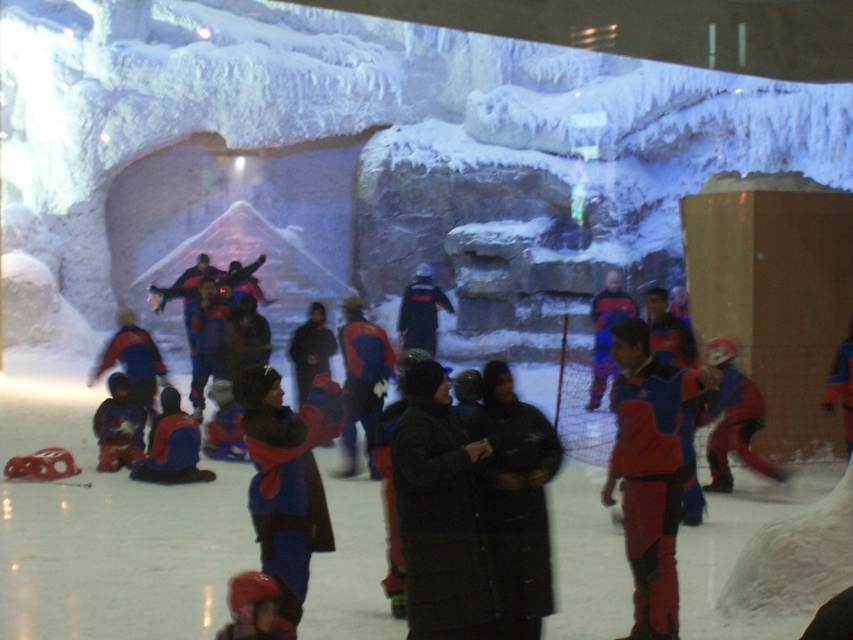
Does matte blue ski suit at center have a lesser height compared to blue fabric snowsuit at center?

In fact, matte blue ski suit at center may be taller than blue fabric snowsuit at center.

This screenshot has width=853, height=640. Describe the element at coordinates (650, 472) in the screenshot. I see `matte blue ski suit at center` at that location.

Between point (674, 577) and point (281, 477), which one is positioned in front?

Point (281, 477) is in front.

Image resolution: width=853 pixels, height=640 pixels. Find the location of `matte blue ski suit at center`. matte blue ski suit at center is located at coordinates pos(650,472).

Who is taller, matte blue ski suit at center or matte red helmet at lower left?

With more height is matte blue ski suit at center.

Is point (659, 564) positioned behind point (265, 625)?

Yes, point (659, 564) is farther from viewer.

In order to click on matte blue ski suit at center in this screenshot , I will do `click(650, 472)`.

Which is above, matte blue jacket at lower left or matte blue snowsuit at lower left?

matte blue snowsuit at lower left is above.

Is matte blue jacket at lower left further to the viewer compared to matte blue snowsuit at lower left?

No.

Image resolution: width=853 pixels, height=640 pixels. I want to click on matte blue jacket at lower left, so point(171,445).